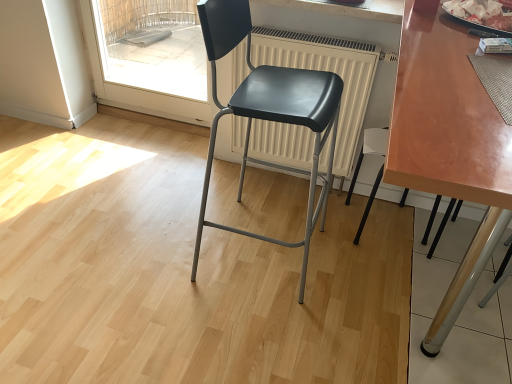
The image size is (512, 384). Find the location of `vacant space to the left of shiny brown table at center`. vacant space to the left of shiny brown table at center is located at coordinates (203, 286).